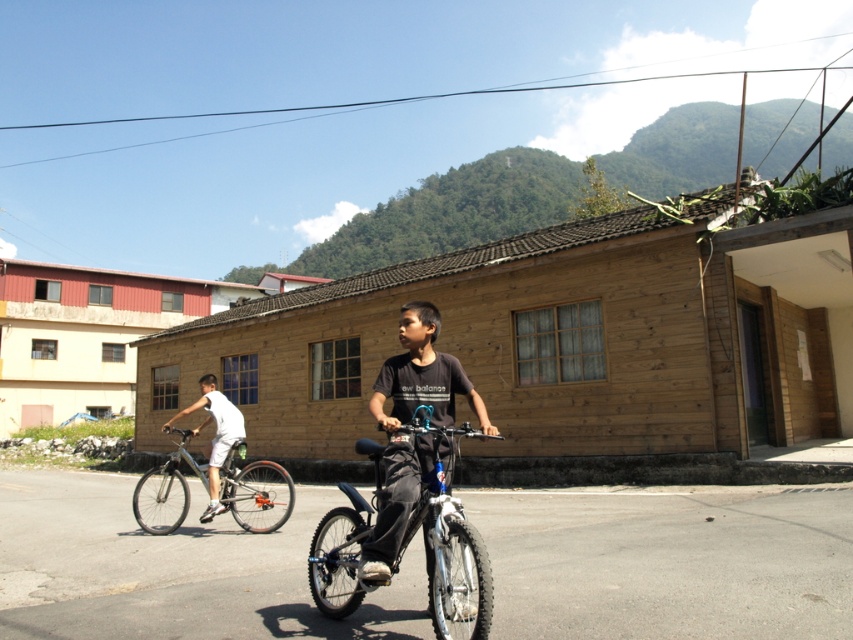
You are standing at the point labeled as point (254,492) in the image. Which object is located at this point?

The silver metallic bicycle at left is located at point (254,492).

From the picture: You are a delivery person who needs to deliver a package to a house located 10 meters ahead of your current position. There is a silver metallic bicycle at left in the scene. Can you safely pass around it to reach the house?

The silver metallic bicycle at left is 8.85 meters away from the camera, so you can safely pass around it to reach the house located 10 meters ahead.

Consider the image. You are a delivery person who needs to load a package onto the shiny blue bicycle at center and the dark gray cotton shirt at center. Which bicycle will require a lower loading height due to its shorter height?

The shiny blue bicycle at center is shorter than the dark gray cotton shirt at center, so the shiny blue bicycle at center will require a lower loading height.